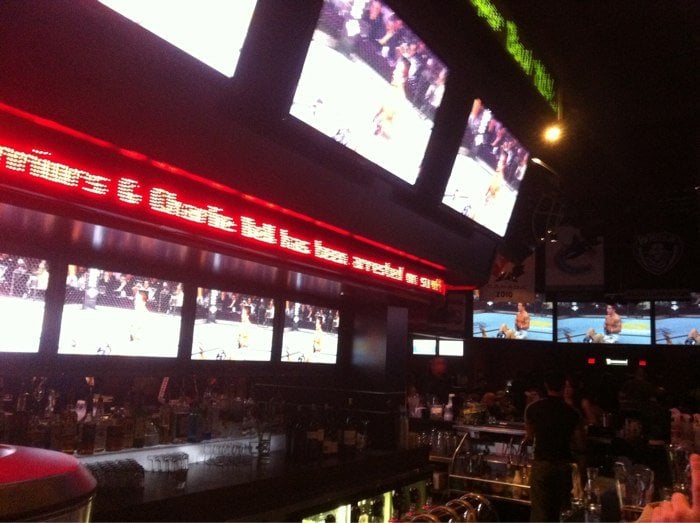
Where is `wall`? The height and width of the screenshot is (523, 700). wall is located at coordinates (629, 187).